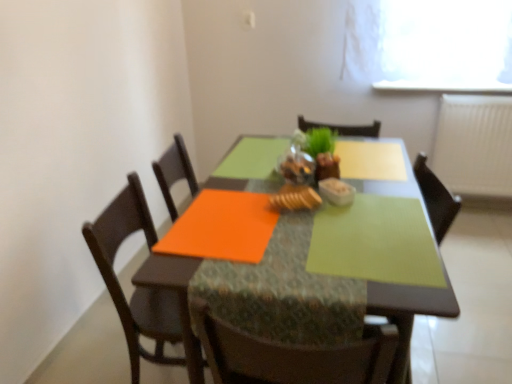
The width and height of the screenshot is (512, 384). What are the coordinates of `vacant space situated above matte glass table at center (from a real-world perspective)` in the screenshot? It's located at (300, 211).